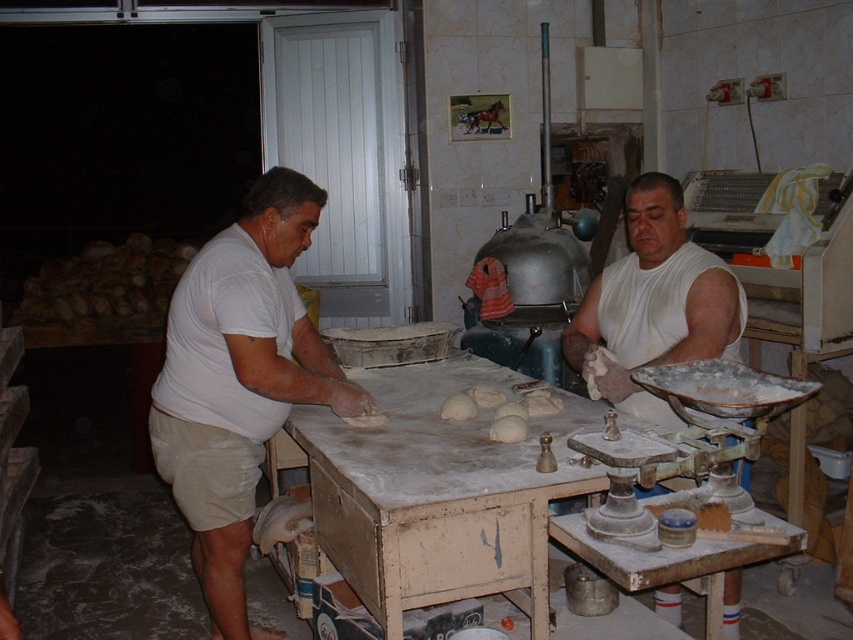
You are a baker who needs to place a large mixing bowl on the surface that can accommodate it. Based on the scene, which object between the white wooden table at center and the white matte shirt at center would be the appropriate choice?

The white wooden table at center is bigger than the white matte shirt at center, so the large mixing bowl should be placed on the white wooden table at center.

In the scene shown: You are a customer entering the bakery and want to observe both the white wooden table at center and the white matte shirt at left. Which object is closer to your eye level?

The white matte shirt at left is closer to your eye level because it is taller than the white wooden table at center.